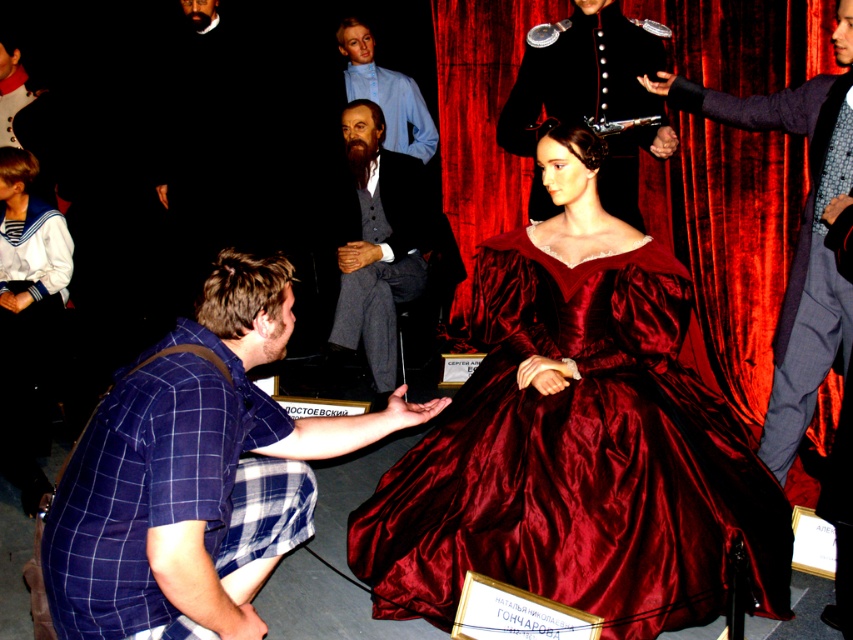
Is shiny burgundy gown at center positioned before shiny black uniform at upper center?

That is True.

Which is in front, point (489, 433) or point (650, 74)?

Point (489, 433)

The image size is (853, 640). I want to click on shiny burgundy gown at center, so click(578, 460).

Does blue plaid shirt at lower left appear on the left side of shiny black uniform at upper center?

Yes, blue plaid shirt at lower left is to the left of shiny black uniform at upper center.

Between blue plaid shirt at lower left and shiny black uniform at upper center, which one is positioned higher?

shiny black uniform at upper center is above.

What do you see at coordinates (195, 474) in the screenshot? This screenshot has height=640, width=853. I see `blue plaid shirt at lower left` at bounding box center [195, 474].

This screenshot has width=853, height=640. In order to click on blue plaid shirt at lower left in this screenshot , I will do `click(195, 474)`.

Consider the image. Which of these two, shiny burgundy gown at center or velvet suit at right, stands taller?

velvet suit at right

Can you confirm if shiny burgundy gown at center is wider than velvet suit at right?

Yes.

Is point (592, 602) closer to camera compared to point (821, 253)?

Yes.

Where is `shiny burgundy gown at center`? This screenshot has width=853, height=640. shiny burgundy gown at center is located at coordinates (578, 460).